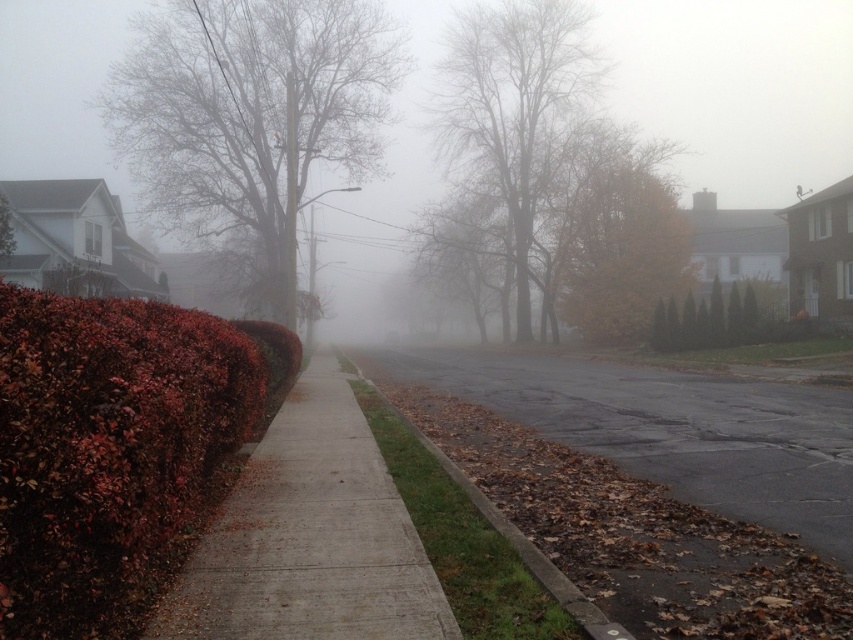
Is shiny red hedge at left taller than brown concrete curb at lower center?

Correct, shiny red hedge at left is much taller as brown concrete curb at lower center.

Can you confirm if shiny red hedge at left is positioned above brown concrete curb at lower center?

Indeed, shiny red hedge at left is positioned over brown concrete curb at lower center.

Between point (28, 413) and point (590, 634), which one is positioned behind?

The point (590, 634) is more distant.

This screenshot has height=640, width=853. Find the location of `shiny red hedge at left`. shiny red hedge at left is located at coordinates (113, 444).

Between brown concrete sidewalk at center and brown asphalt at center, which one appears on the left side from the viewer's perspective?

Positioned to the left is brown concrete sidewalk at center.

In the scene shown: Who is more forward, (233, 499) or (618, 364)?

Point (233, 499) is in front.

Who is more forward, (206, 600) or (795, 500)?

Point (206, 600) is in front.

The width and height of the screenshot is (853, 640). Identify the location of brown concrete sidewalk at center. (310, 538).

Who is positioned more to the right, bare branches at center or green textured hedge at center?

From the viewer's perspective, green textured hedge at center appears more on the right side.

Does bare branches at center have a larger size compared to green textured hedge at center?

Yes.

What are the coordinates of `bare branches at center` in the screenshot? It's located at (514, 109).